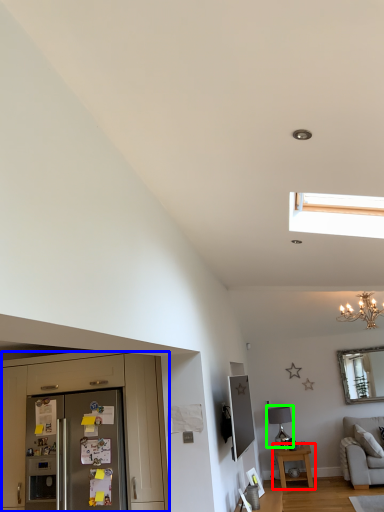
Question: Which object is the farthest from table (highlighted by a red box)? Choose among these: cabinetry (highlighted by a blue box) or lamp (highlighted by a green box).

Choices:
 (A) cabinetry
 (B) lamp

Answer: (A)